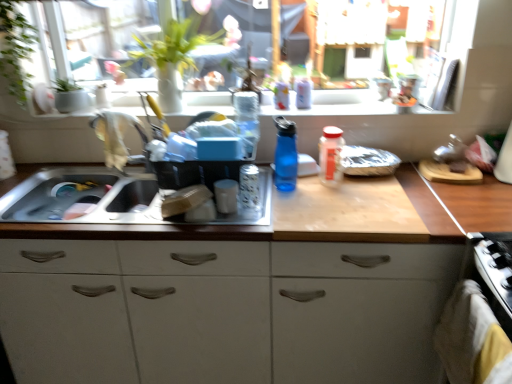
Question: From the image's perspective, is white plastic bottle at upper center, placed as the 2th bottle when sorted from right to left, positioned above or below transparent glass window at upper center?

Choices:
 (A) above
 (B) below

Answer: (B)

Question: Is white plastic bottle at upper center, positioned as the 4th bottle in left-to-right order, to the left or to the right of transparent glass window at upper center in the image?

Choices:
 (A) right
 (B) left

Answer: (A)

Question: Estimate the real-world distances between objects in this image. Which object is closer to the translucent glass jar at sink, arranged as the fifth bottle when viewed from the right?

Choices:
 (A) white fabric oven at lower right
 (B) white plastic bottle at upper center, placed as the 2th bottle when sorted from right to left
 (C) blue plastic water bottle at center, placed as the 4th bottle when sorted from right to left
 (D) matte white window sill at upper center
 (E) white fabric at left

Answer: (C)

Question: Which of these objects is positioned closest to the blue plastic water bottle at center, acting as the 2th bottle starting from the left?

Choices:
 (A) white plastic bottle at upper center, positioned as the 4th bottle in left-to-right order
 (B) matte white window sill at upper center
 (C) green leafy plant at upper left
 (D) white matte cup at sink
 (E) transparent glass window at upper center

Answer: (D)